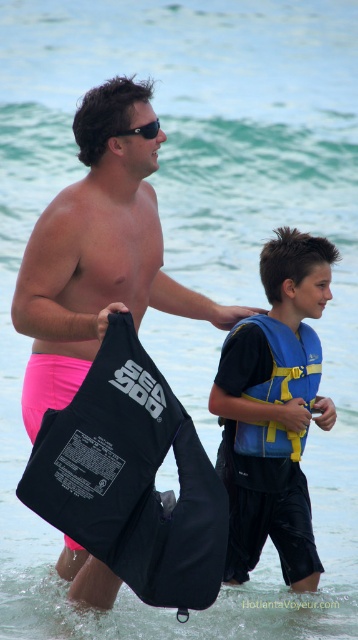
Does blue/yellow life vest at center have a greater height compared to black plastic sunglasses at upper center?

Yes, blue/yellow life vest at center is taller than black plastic sunglasses at upper center.

Does blue/yellow life vest at center have a greater width compared to black plastic sunglasses at upper center?

No.

Which is in front, point (310, 278) or point (150, 122)?

Point (150, 122)

Image resolution: width=358 pixels, height=640 pixels. I want to click on blue/yellow life vest at center, so click(x=274, y=410).

Who is more forward, (124, 99) or (146, 131)?

Point (124, 99) is in front.

Does pink fabric shorts at center appear on the right side of black plastic sunglasses at upper center?

Correct, you'll find pink fabric shorts at center to the right of black plastic sunglasses at upper center.

Is point (23, 385) closer to viewer compared to point (156, 129)?

No.

This screenshot has width=358, height=640. I want to click on pink fabric shorts at center, so click(x=99, y=252).

Consider the image. Is pink fabric shorts at center smaller than blue/yellow life jacket at center?

Actually, pink fabric shorts at center might be larger than blue/yellow life jacket at center.

Identify the location of pink fabric shorts at center. (99, 252).

Locate an element on the screen. This screenshot has width=358, height=640. pink fabric shorts at center is located at coordinates tap(99, 252).